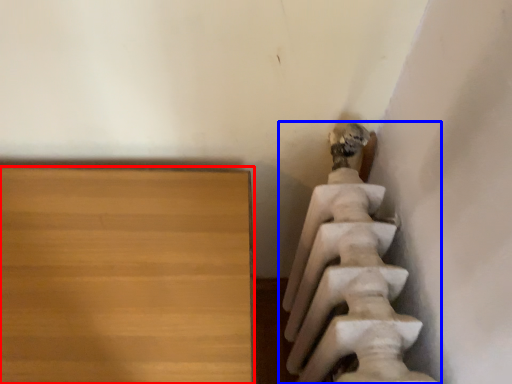
Question: Which object is closer to the camera taking this photo, furniture (highlighted by a red box) or statue (sculpture) (highlighted by a blue box)?

Choices:
 (A) furniture
 (B) statue (sculpture)

Answer: (B)